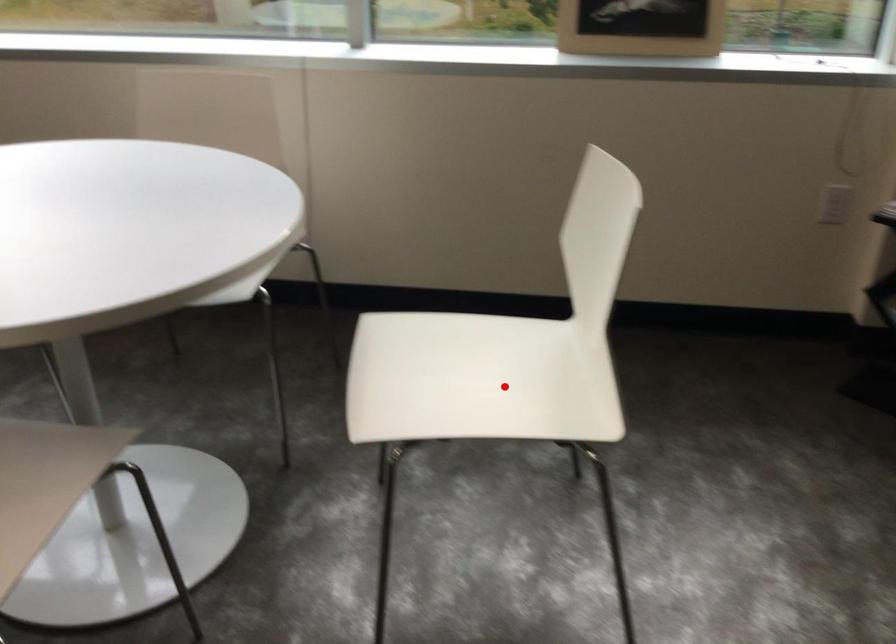
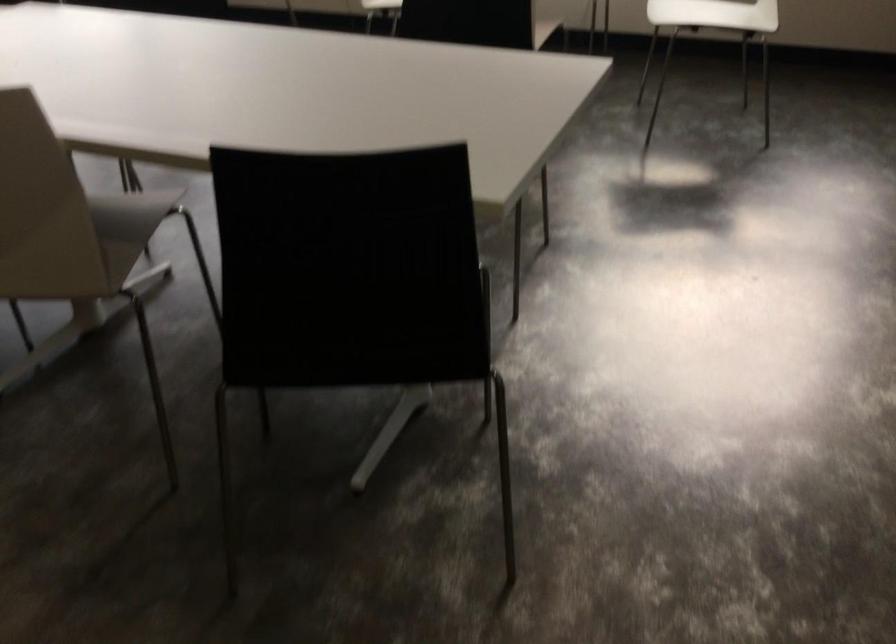
Where in the second image is the point corresponding to the highlighted location from the first image?

(714, 14)